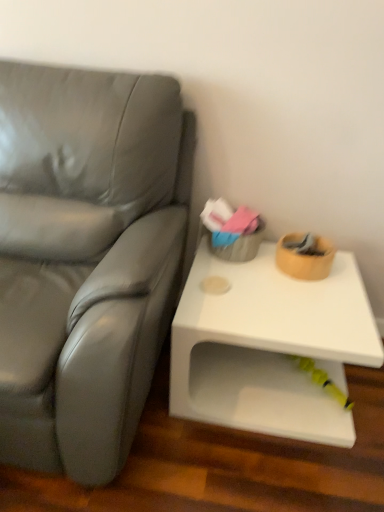
Locate an element on the screen. white glossy table at right is located at coordinates (269, 347).

Image resolution: width=384 pixels, height=512 pixels. What do you see at coordinates (269, 347) in the screenshot?
I see `white glossy table at right` at bounding box center [269, 347].

What is the approximate height of matte gray couch at left?

matte gray couch at left is 3.29 feet in height.

Describe the element at coordinates (86, 258) in the screenshot. I see `matte gray couch at left` at that location.

Locate an element on the screen. Image resolution: width=384 pixels, height=512 pixels. matte gray couch at left is located at coordinates (x=86, y=258).

You are a GUI agent. You are given a task and a screenshot of the screen. Output one action in this format:
    pyautogui.click(x=<x>, y=<y>)
    Task: Click on the white glossy table at right
    
    Given the screenshot: What is the action you would take?
    pyautogui.click(x=269, y=347)

Consider the image. Which object is positioned more to the right, white glossy table at right or matte gray couch at left?

From the viewer's perspective, white glossy table at right appears more on the right side.

Is white glossy table at right in front of matte gray couch at left?

No, white glossy table at right is further to the viewer.

Is point (299, 303) closer or farther from the camera than point (27, 422)?

Clearly, point (299, 303) is more distant from the camera than point (27, 422).

From the image's perspective, which one is positioned lower, white glossy table at right or matte gray couch at left?

white glossy table at right.

From a real-world perspective, is white glossy table at right physically above matte gray couch at left?

No, from a real-world perspective, white glossy table at right is not over matte gray couch at left

Can you confirm if white glossy table at right is wider than matte gray couch at left?

In fact, white glossy table at right might be narrower than matte gray couch at left.

Consider the image. Considering the sizes of white glossy table at right and matte gray couch at left in the image, is white glossy table at right taller or shorter than matte gray couch at left?

white glossy table at right is shorter than matte gray couch at left.

Considering the sizes of objects white glossy table at right and matte gray couch at left in the image provided, who is bigger, white glossy table at right or matte gray couch at left?

With larger size is matte gray couch at left.

Is white glossy table at right outside of matte gray couch at left?

white glossy table at right is positioned outside matte gray couch at left.

From the picture: Is white glossy table at right next to matte gray couch at left and touching it?

No, white glossy table at right is not making contact with matte gray couch at left.

Is white glossy table at right positioned with its back to matte gray couch at left?

No.

Where is `studio couch on the left side of white glossy table at right`? studio couch on the left side of white glossy table at right is located at coordinates (86, 258).

Is matte gray couch at left at the left side of white glossy table at right?

Correct, you'll find matte gray couch at left to the left of white glossy table at right.

Relative to white glossy table at right, is matte gray couch at left in front or behind?

Clearly, matte gray couch at left is in front of white glossy table at right.

Is point (166, 254) closer to camera compared to point (200, 256)?

Yes.

From the image's perspective, is matte gray couch at left located beneath white glossy table at right?

Incorrect, from the image's perspective, matte gray couch at left is higher than white glossy table at right.

Consider the image. From a real-world perspective, who is located lower, matte gray couch at left or white glossy table at right?

white glossy table at right, from a real-world perspective.

Which of these two, matte gray couch at left or white glossy table at right, is wider?

matte gray couch at left is wider.

Which of these two, matte gray couch at left or white glossy table at right, stands shorter?

With less height is white glossy table at right.

Can you confirm if matte gray couch at left is bigger than white glossy table at right?

Indeed, matte gray couch at left has a larger size compared to white glossy table at right.

Is white glossy table at right surrounded by matte gray couch at left?

No.

Is the surface of matte gray couch at left in direct contact with white glossy table at right?

There is a gap between matte gray couch at left and white glossy table at right.

Is matte gray couch at left oriented towards white glossy table at right?

No.

The image size is (384, 512). I want to click on table directly beneath the matte gray couch at left (from a real-world perspective), so click(269, 347).

Where is `studio couch located in front of the white glossy table at right`? This screenshot has height=512, width=384. studio couch located in front of the white glossy table at right is located at coordinates (86, 258).

Where is `table behind the matte gray couch at left`? Image resolution: width=384 pixels, height=512 pixels. table behind the matte gray couch at left is located at coordinates (269, 347).